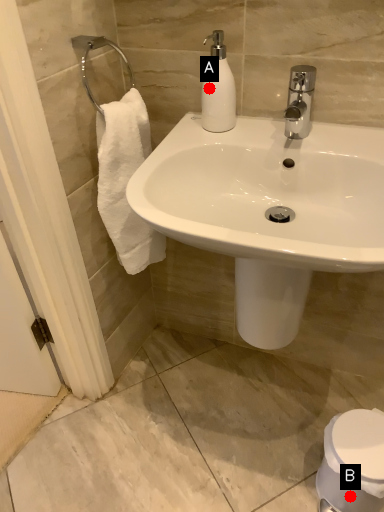
Question: Two points are circled on the image, labeled by A and B beside each circle. Which of the following is the farthest from the observer?

Choices:
 (A) A is further
 (B) B is further

Answer: (B)